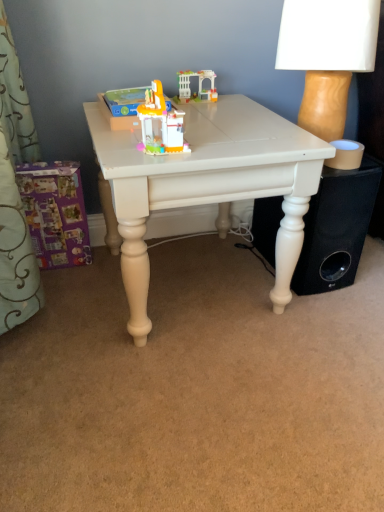
Find the location of a particular element. free region under white painted wood table at center (from a real-world perspective) is located at coordinates (198, 279).